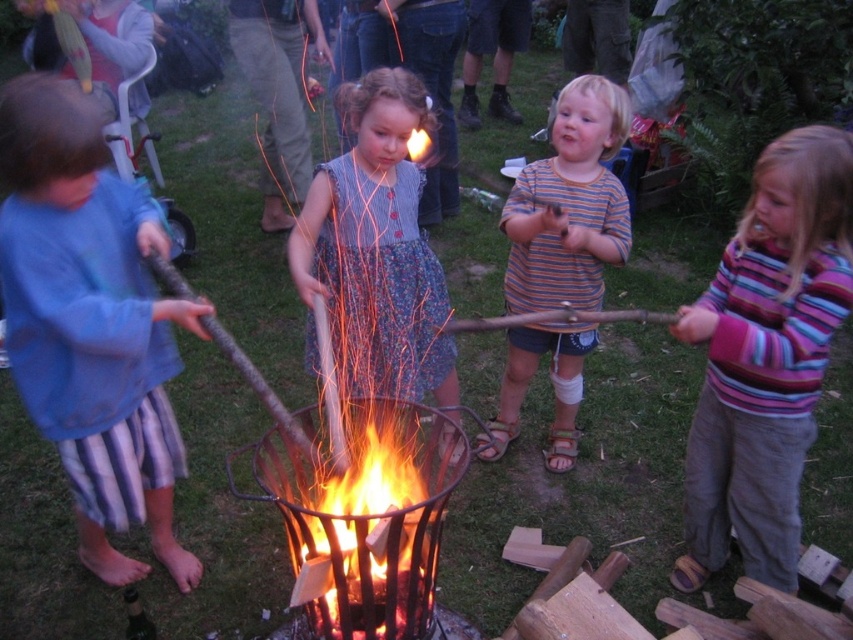
Question: From the image, what is the correct spatial relationship of blue cotton shirt at left in relation to flaming wood at center?

Choices:
 (A) right
 (B) left

Answer: (B)

Question: Among these points, which one is farthest from the camera?

Choices:
 (A) (376, 636)
 (B) (543, 204)
 (C) (386, 193)
 (D) (137, 470)

Answer: (C)

Question: Does striped cotton shirt at center have a smaller size compared to flaming wood at center?

Choices:
 (A) no
 (B) yes

Answer: (A)

Question: Considering the real-world distances, which object is farthest from the flaming wood at center?

Choices:
 (A) striped cotton shirt at center
 (B) blue cotton shirt at left

Answer: (A)

Question: Does striped sweater at center appear on the right side of flaming wood at center?

Choices:
 (A) no
 (B) yes

Answer: (B)

Question: Which is farther from the striped cotton shirt at center?

Choices:
 (A) flaming wood at center
 (B) floral dress at center
 (C) blue cotton shirt at left
 (D) striped sweater at center

Answer: (C)